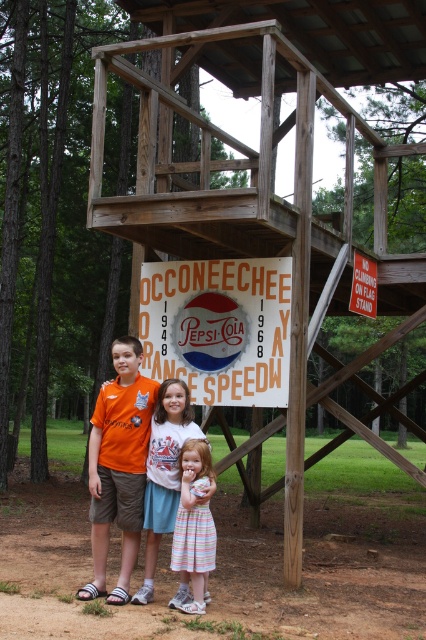
Which of these two, white cotton dress at center or striped cotton dress at center, stands shorter?

striped cotton dress at center is shorter.

Who is lower down, white cotton dress at center or striped cotton dress at center?

striped cotton dress at center is lower down.

Measure the distance between point (169,488) and camera.

The distance of point (169,488) from camera is 7.12 meters.

Identify the location of white cotton dress at center. (164, 472).

Can you confirm if orange t-shirt at center is positioned to the right of striped cotton dress at center?

In fact, orange t-shirt at center is to the left of striped cotton dress at center.

At what (x,y) coordinates should I click in order to perform the action: click on orange t-shirt at center. Please return your answer as a coordinate pair (x, y). Image resolution: width=426 pixels, height=640 pixels. Looking at the image, I should click on (118, 465).

Consider the image. Who is more forward, [94,524] or [204,541]?

Point [204,541] is in front.

Find the location of `orange t-shirt at center`. orange t-shirt at center is located at coordinates (118, 465).

Can you confirm if wooden at center is taller than orange t-shirt at center?

Yes, wooden at center is taller than orange t-shirt at center.

Between point (132, 224) and point (103, 426), which one is positioned behind?

The point (132, 224) is behind.

Is point (287, 61) closer to viewer compared to point (138, 452)?

No.

The image size is (426, 640). I want to click on wooden at center, so click(259, 161).